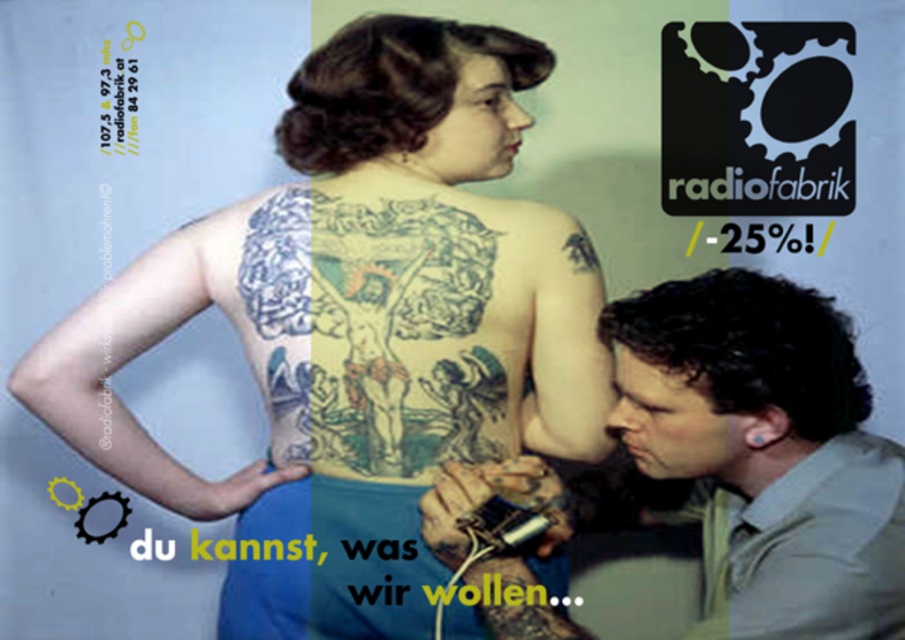
Is matte gray shirt at lower right to the left of blue fabric tattoo at upper left from the viewer's perspective?

In fact, matte gray shirt at lower right is to the right of blue fabric tattoo at upper left.

Does matte gray shirt at lower right have a larger size compared to blue fabric tattoo at upper left?

Indeed, matte gray shirt at lower right has a larger size compared to blue fabric tattoo at upper left.

At what (x,y) coordinates should I click in order to perform the action: click on matte gray shirt at lower right. Please return your answer as a coordinate pair (x, y). This screenshot has width=905, height=640. Looking at the image, I should click on (755, 454).

Image resolution: width=905 pixels, height=640 pixels. Find the location of `matte gray shirt at lower right`. matte gray shirt at lower right is located at coordinates (755, 454).

Can you confirm if matte gray shirt at lower right is positioned below black ink bird at upper center?

Yes.

Where is `matte gray shirt at lower right`? This screenshot has width=905, height=640. matte gray shirt at lower right is located at coordinates (755, 454).

Which is behind, point (179, 301) or point (589, 252)?

The point (179, 301) is behind.

Does blue fabric tattoo at upper left have a greater width compared to black ink bird at upper center?

Correct, the width of blue fabric tattoo at upper left exceeds that of black ink bird at upper center.

Image resolution: width=905 pixels, height=640 pixels. I want to click on blue fabric tattoo at upper left, so click(139, 353).

At what (x,y) coordinates should I click in order to perform the action: click on blue fabric tattoo at upper left. Please return your answer as a coordinate pair (x, y). This screenshot has height=640, width=905. Looking at the image, I should click on (139, 353).